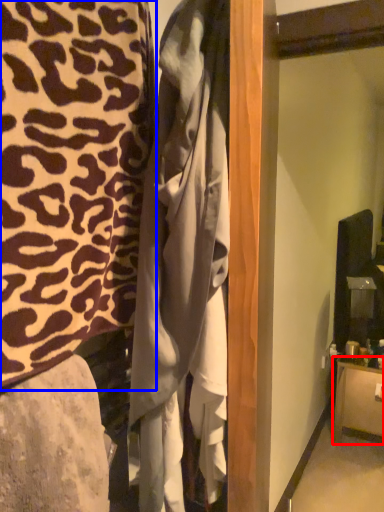
Question: Among these objects, which one is nearest to the camera, furniture (highlighted by a red box) or furniture (highlighted by a blue box)?

Choices:
 (A) furniture
 (B) furniture

Answer: (B)